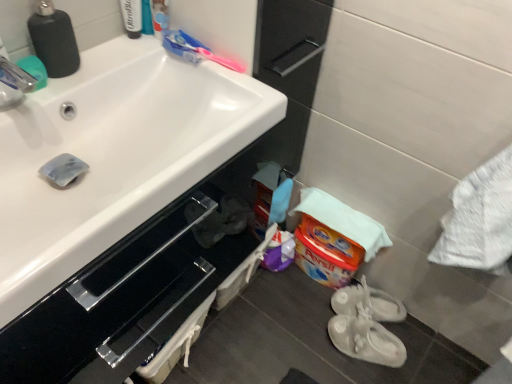
Identify the location of vacant area located to the right-hand side of white rubber shoes at lower right, positioned as the 1th footwear in back-to-front order. (430, 340).